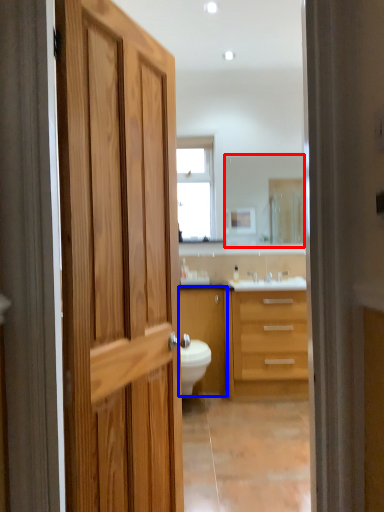
Question: Which point is closer to the camera, mirror (highlighted by a red box) or cabinetry (highlighted by a blue box)?

Choices:
 (A) mirror
 (B) cabinetry

Answer: (B)